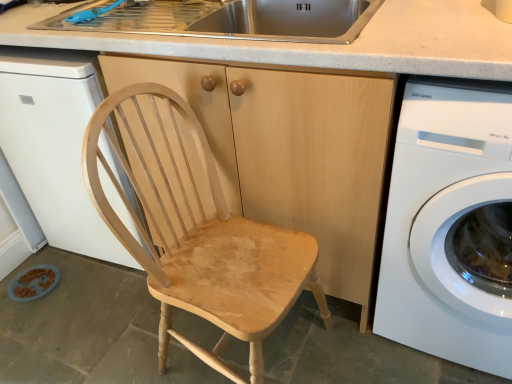
Locate an element on the screen. The width and height of the screenshot is (512, 384). free point above stainless steel sink at upper center (from a real-world perspective) is located at coordinates [130, 11].